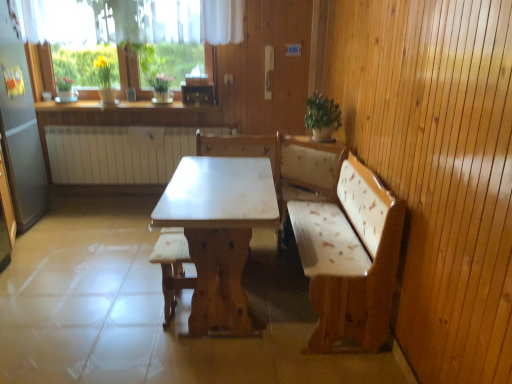
The image size is (512, 384). In order to click on free space to the left of white fabric cushion at center in this screenshot , I will do `click(135, 314)`.